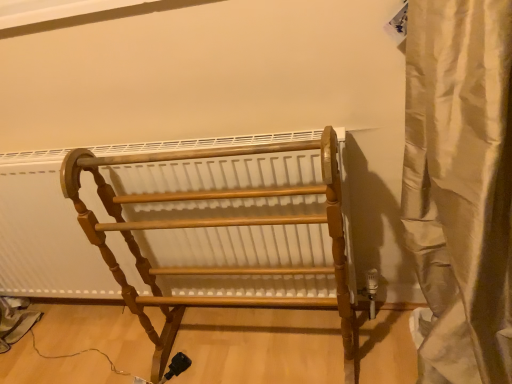
Question: Would you say beige satin curtain at right is inside or outside wooden towel rack at center?

Choices:
 (A) inside
 (B) outside

Answer: (B)

Question: Is beige satin curtain at right taller or shorter than wooden towel rack at center?

Choices:
 (A) short
 (B) tall

Answer: (B)

Question: From a real-world perspective, is beige satin curtain at right physically located above or below wooden towel rack at center?

Choices:
 (A) below
 (B) above

Answer: (B)

Question: Considering their positions, is wooden towel rack at center located in front of or behind beige satin curtain at right?

Choices:
 (A) behind
 (B) front

Answer: (A)

Question: Considering the positions of wooden towel rack at center and beige satin curtain at right in the image, is wooden towel rack at center wider or thinner than beige satin curtain at right?

Choices:
 (A) wide
 (B) thin

Answer: (B)

Question: From the image's perspective, relative to beige satin curtain at right, is wooden towel rack at center above or below?

Choices:
 (A) below
 (B) above

Answer: (A)

Question: Is wooden towel rack at center inside or outside of beige satin curtain at right?

Choices:
 (A) outside
 (B) inside

Answer: (A)